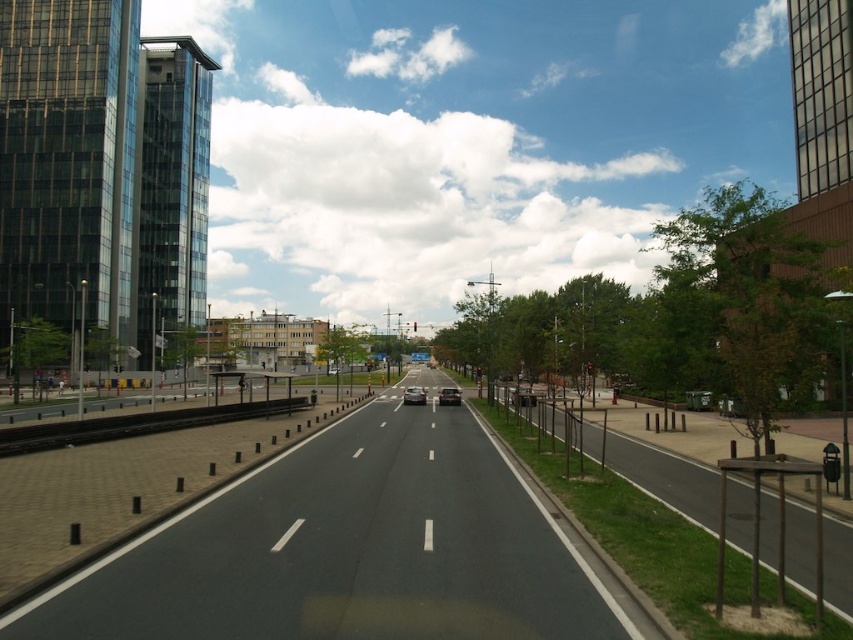
Question: Which of these objects is positioned closest to the shiny black sedan at center?

Choices:
 (A) metallic silver car at center
 (B) shiny silver car at center

Answer: (B)

Question: Is metallic silver car at center to the right of shiny black sedan at center from the viewer's perspective?

Choices:
 (A) yes
 (B) no

Answer: (A)

Question: Can you confirm if black asphalt highway at center is wider than shiny black sedan at center?

Choices:
 (A) yes
 (B) no

Answer: (A)

Question: Can you confirm if black asphalt highway at center is positioned to the right of shiny black sedan at center?

Choices:
 (A) yes
 (B) no

Answer: (B)

Question: Which point appears farthest from the camera in this image?

Choices:
 (A) (480, 528)
 (B) (440, 394)
 (C) (525, 404)

Answer: (B)

Question: Among these objects, which one is farthest from the camera?

Choices:
 (A) metallic silver car at center
 (B) shiny black sedan at center
 (C) shiny silver car at center
 (D) black asphalt highway at center

Answer: (C)